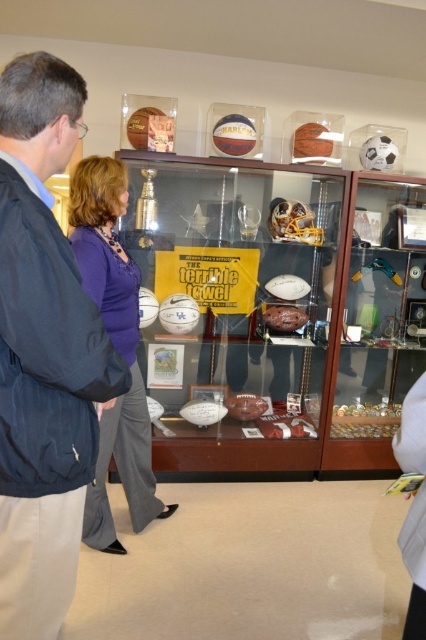
You are a visitor at the museum and want to take a photo of both the dark blue jacket at left and the purple fabric blouse at center. However, you can only take one photo from your current position. Will you be able to capture both items in the same photo without moving your camera?

The dark blue jacket at left is in front of the purple fabric blouse at center, so if you position yourself so that both are within the camera frame, the dark blue jacket at left may partially obscure the purple fabric blouse at center but both can still be captured in the same photo.

You are standing in front of the museum display case and want to touch the two points marked in the image. Which point, point (28, 252) or point (158, 509), is closer to you?

Point (28, 252) is closer to the viewer than point (158, 509), so you can reach it first.

You are a museum visitor standing in front of the display case. You see the dark blue jacket at left and the purple fabric blouse at center. Which item is shorter in height?

The dark blue jacket at left is shorter in height compared to the purple fabric blouse at center.